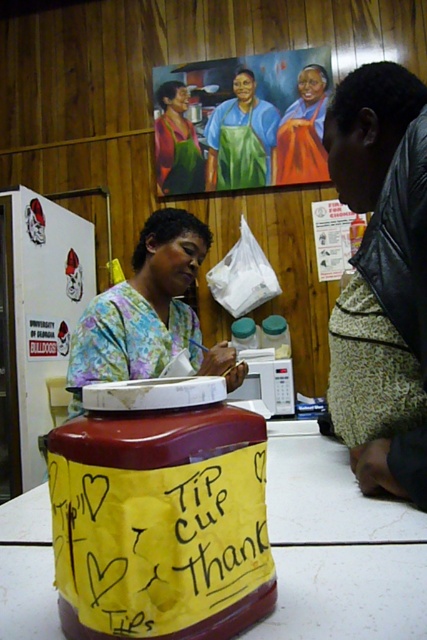
You are a customer standing at the counter in the cafe. You want to place your order and then move to the area near the wooden paneling in the background. Which direction should you move relative to the two points labeled point (90, 308) and point (175, 177)?

You should move towards the area near point (175, 177) because it is farther from you than point (90, 308), which aligns with the direction of the wooden paneling in the background.

You are a customer in the cafe and want to give a tip. You see the red cylindrical container with a yellow paper label wrapped around its base. Where is it located relative to the orange fabric dress at center and the green apron at upper center?

The red cylindrical container with a yellow paper label wrapped around its base is located to the left of the orange fabric dress at center and the green apron at upper center.